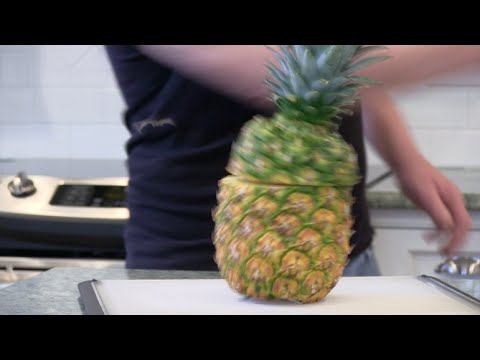
Find the location of a particular element. chopping board is located at coordinates (221, 305).